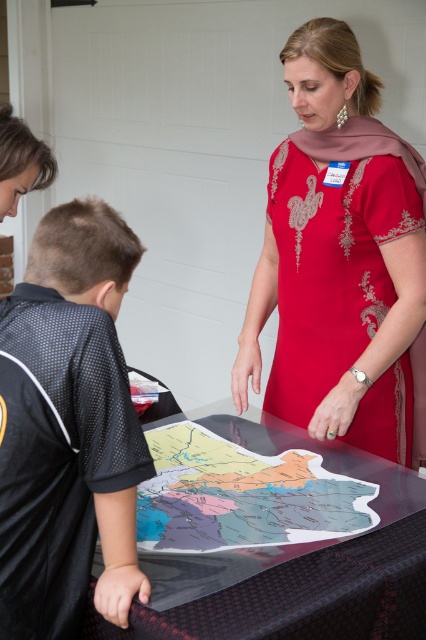
What object is located at the coordinates point [333,256]?

The point [333,256] indicates the red embroidered dress at center.